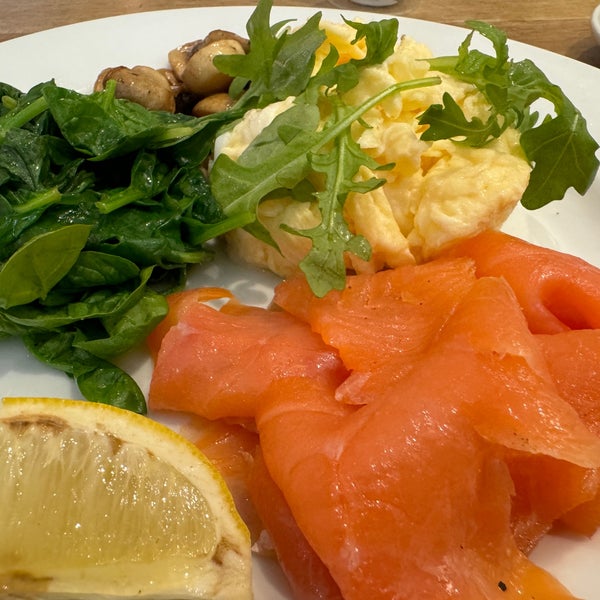
At what (x,y) coordinates should I click in order to perform the action: click on plate. Please return your answer as a coordinate pair (x, y). Looking at the image, I should click on [x=40, y=367], [x=114, y=30], [x=568, y=226].